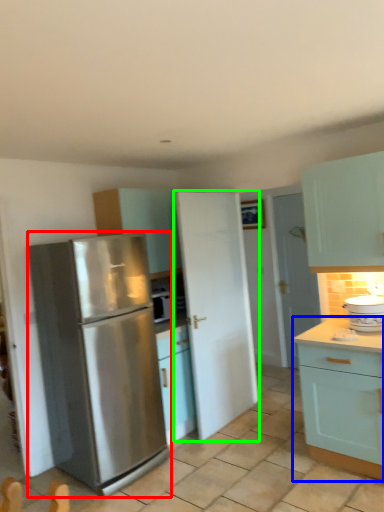
Question: Estimate the real-world distances between objects in this image. Which object is farther from refrigerator (highlighted by a red box), cabinetry (highlighted by a blue box) or door (highlighted by a green box)?

Choices:
 (A) cabinetry
 (B) door

Answer: (A)